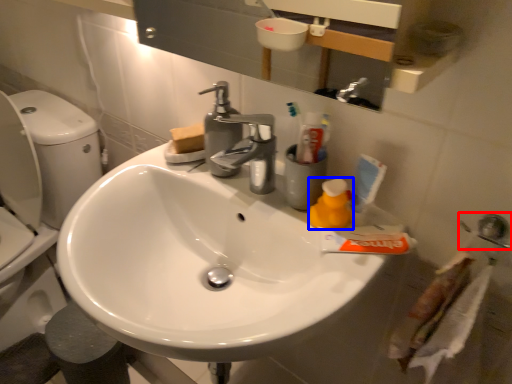
Question: Which of the following is the closest to the observer, plumbing fixture (highlighted by a red box) or cleaning product (highlighted by a blue box)?

Choices:
 (A) plumbing fixture
 (B) cleaning product

Answer: (A)